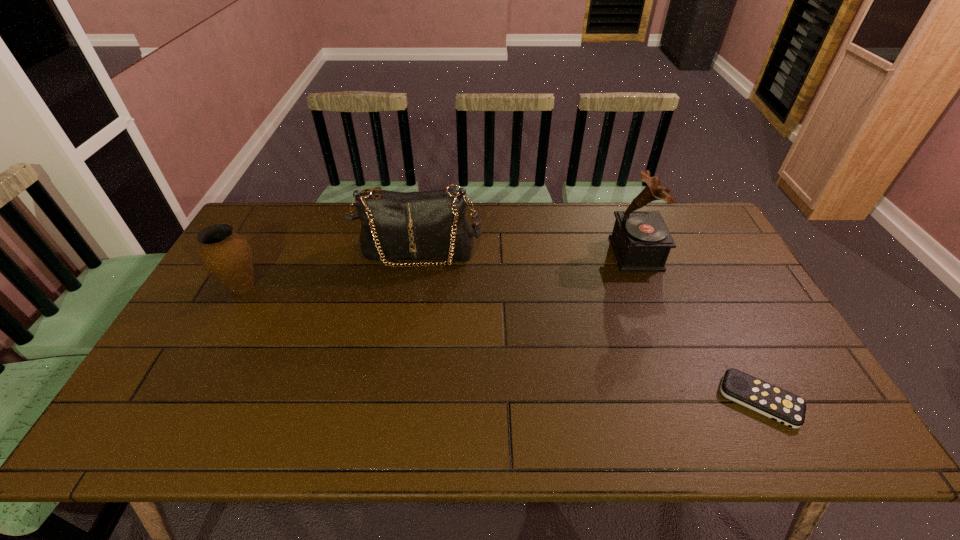
This screenshot has width=960, height=540. In order to click on phonograph_record in this screenshot , I will do `click(641, 241)`.

The height and width of the screenshot is (540, 960). Find the location of `handbag`. handbag is located at coordinates (430, 225).

Find the location of `urn`. urn is located at coordinates (227, 256).

Find the location of a particular element. The height and width of the screenshot is (540, 960). the third farthest object is located at coordinates (227, 256).

Locate an element on the screen. The width and height of the screenshot is (960, 540). the nearest object is located at coordinates (778, 404).

You are a GUI agent. You are given a task and a screenshot of the screen. Output one action in this format:
    pyautogui.click(x=<x>, y=<y>)
    Task: Click on the shortest object
    
    Given the screenshot: What is the action you would take?
    pyautogui.click(x=778, y=404)

The height and width of the screenshot is (540, 960). Find the location of `vacant space situated at the horn opening of the phonograph_record`. vacant space situated at the horn opening of the phonograph_record is located at coordinates (592, 253).

Find the location of a particular element. This screenshot has width=960, height=540. free space located 0.390m at the horn opening of the phonograph_record is located at coordinates (492, 253).

At what (x,y) coordinates should I click in order to perform the action: click on vacant space located at the horn opening of the phonograph_record. Please return your answer as a coordinate pair (x, y). The image size is (960, 540). Looking at the image, I should click on (548, 253).

The width and height of the screenshot is (960, 540). I want to click on free space located 0.340m at the front of the handbag with chain and zipper, so click(401, 363).